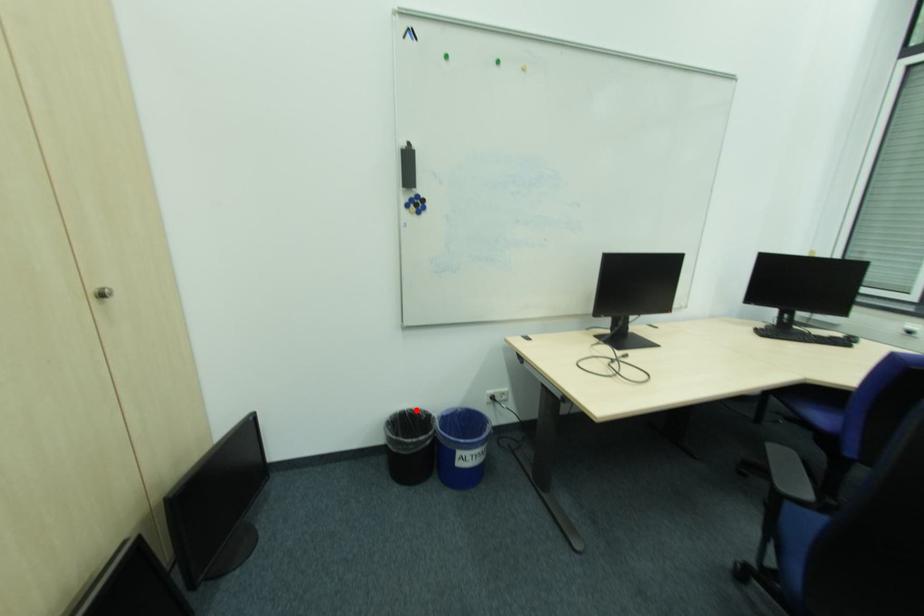
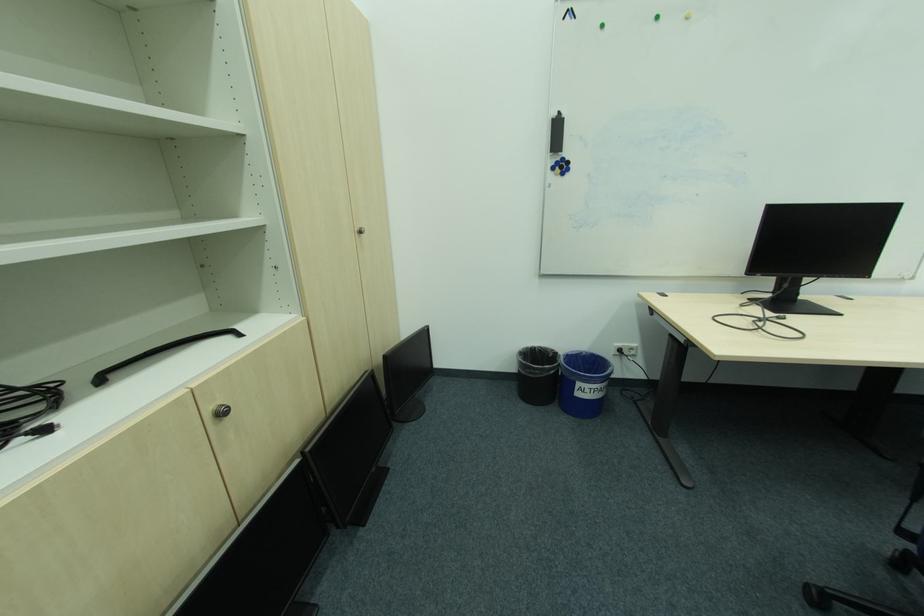
Find the pixel in the second image that matches the highlighted location in the first image.

(546, 347)